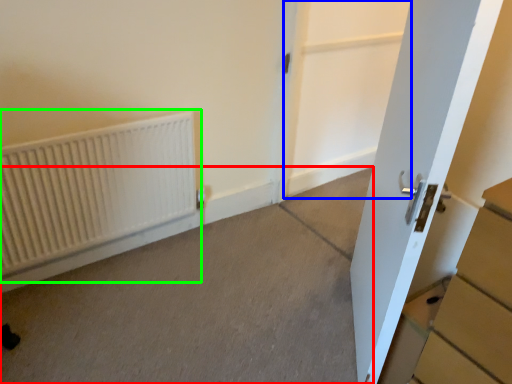
Question: Which object is the farthest from concrete (highlighted by a red box)? Choose among these: screen door (highlighted by a blue box) or radiator (highlighted by a green box).

Choices:
 (A) screen door
 (B) radiator

Answer: (A)